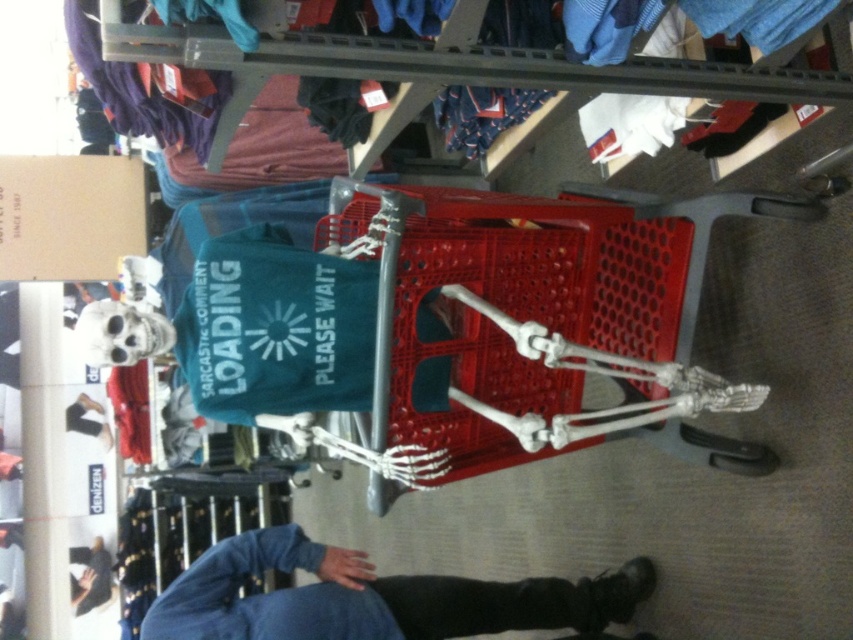
Between red plastic trolley at center and blue soft sweatshirt at lower center, which one appears on the left side from the viewer's perspective?

blue soft sweatshirt at lower center

Is red plastic trolley at center bigger than blue soft sweatshirt at lower center?

Indeed, red plastic trolley at center has a larger size compared to blue soft sweatshirt at lower center.

Does point (561, 396) come in front of point (496, 605)?

Yes, it is.

This screenshot has width=853, height=640. I want to click on red plastic trolley at center, so click(544, 317).

Is point (328, 240) closer to camera compared to point (88, 547)?

That is True.

Is point (498, 300) positioned after point (82, 596)?

No, (498, 300) is in front of (82, 596).

Identify the location of red plastic trolley at center. The height and width of the screenshot is (640, 853). (544, 317).

Can you confirm if blue soft sweatshirt at lower center is shorter than blue fabric shirt at lower center?

Yes, blue soft sweatshirt at lower center is shorter than blue fabric shirt at lower center.

Between blue soft sweatshirt at lower center and blue fabric shirt at lower center, which one is positioned higher?

blue soft sweatshirt at lower center is higher up.

The width and height of the screenshot is (853, 640). I want to click on blue soft sweatshirt at lower center, so click(x=374, y=596).